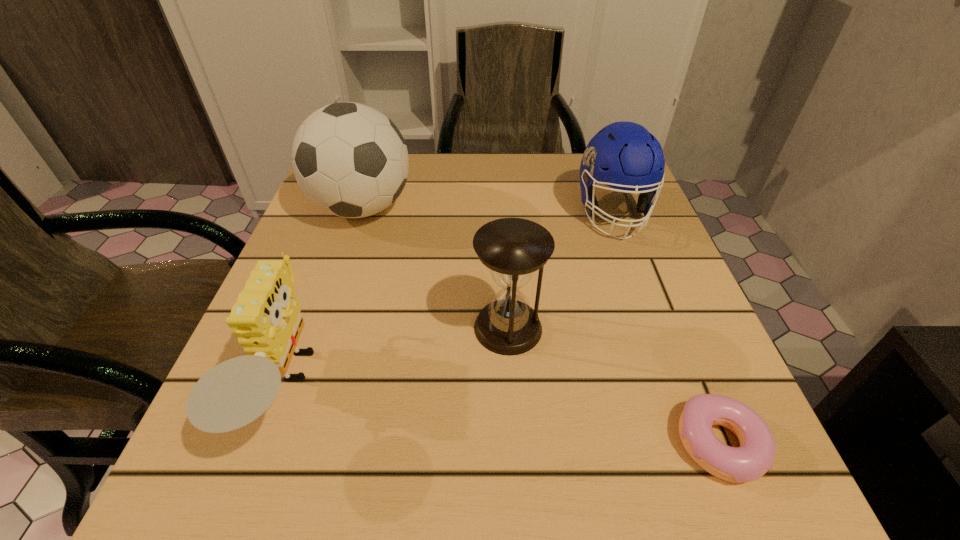
Locate an element on the screen. This screenshot has height=540, width=960. soccer ball at the far edge is located at coordinates (350, 160).

Find the location of `football helmet at the far edge`. football helmet at the far edge is located at coordinates (623, 155).

Locate an element on the screen. sponge located at the near edge is located at coordinates (266, 318).

At what (x,y) coordinates should I click in order to perform the action: click on doughnut positioned at the near edge. Please return your answer as a coordinate pair (x, y). Looking at the image, I should click on (755, 456).

Where is `soccer ball that is positioned at the left edge`? Image resolution: width=960 pixels, height=540 pixels. soccer ball that is positioned at the left edge is located at coordinates (350, 160).

At what (x,y) coordinates should I click in order to perform the action: click on sponge situated at the left edge. Please return your answer as a coordinate pair (x, y). This screenshot has width=960, height=540. Looking at the image, I should click on (266, 318).

Locate an element on the screen. The height and width of the screenshot is (540, 960). football helmet situated at the right edge is located at coordinates (623, 155).

This screenshot has width=960, height=540. What are the coordinates of `doughnut that is at the right edge` in the screenshot? It's located at (755, 456).

Where is `object situated at the far left corner`? The width and height of the screenshot is (960, 540). object situated at the far left corner is located at coordinates (350, 160).

Identify the location of object located in the near left corner section of the desktop. [266, 318].